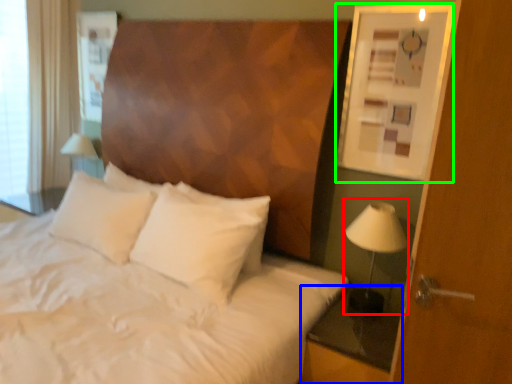
Question: Considering the real-world distances, which object is closest to bedside lamp (highlighted by a red box)? nightstand (highlighted by a blue box) or picture frame (highlighted by a green box).

Choices:
 (A) nightstand
 (B) picture frame

Answer: (A)